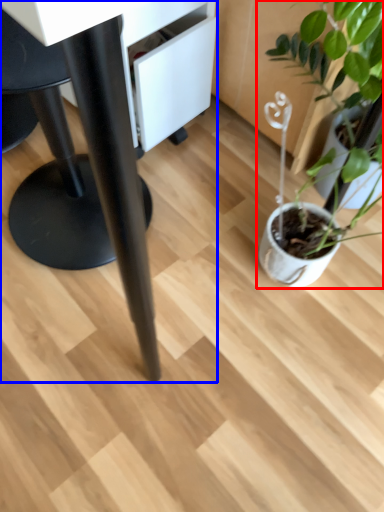
Question: Among these objects, which one is farthest to the camera, houseplant (highlighted by a red box) or table (highlighted by a blue box)?

Choices:
 (A) houseplant
 (B) table

Answer: (A)